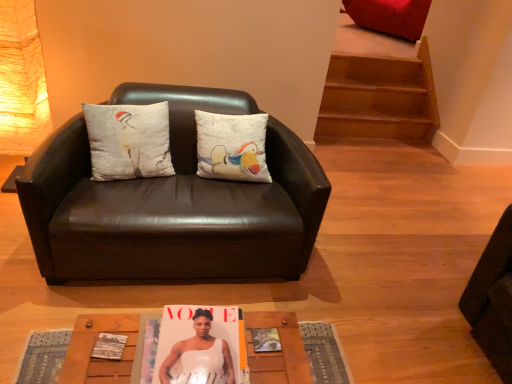
The height and width of the screenshot is (384, 512). What are the coordinates of `vacant area that is situated to the right of wooden textured table at lower center` in the screenshot? It's located at (382, 312).